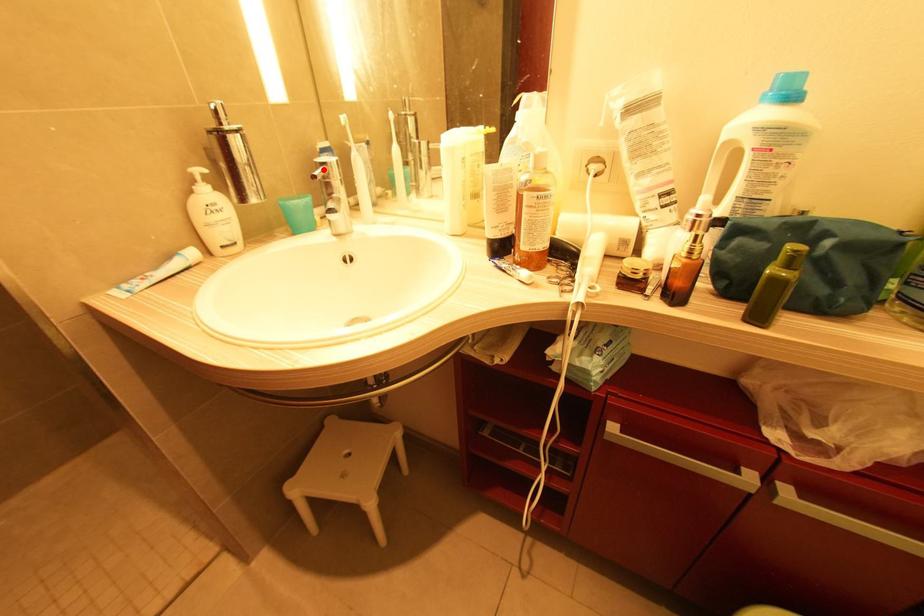
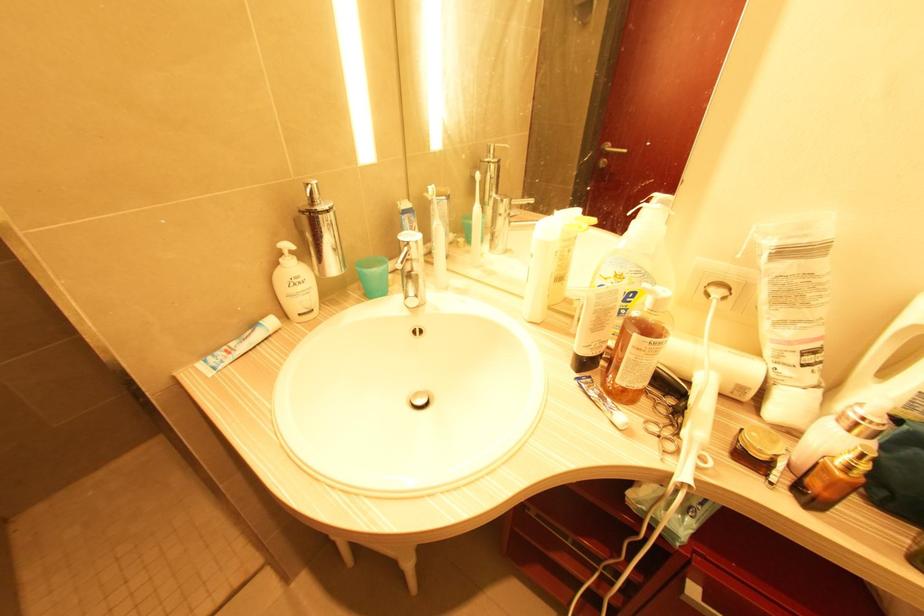
In the second image, find the point that corresponds to the highlighted location in the first image.

(407, 249)